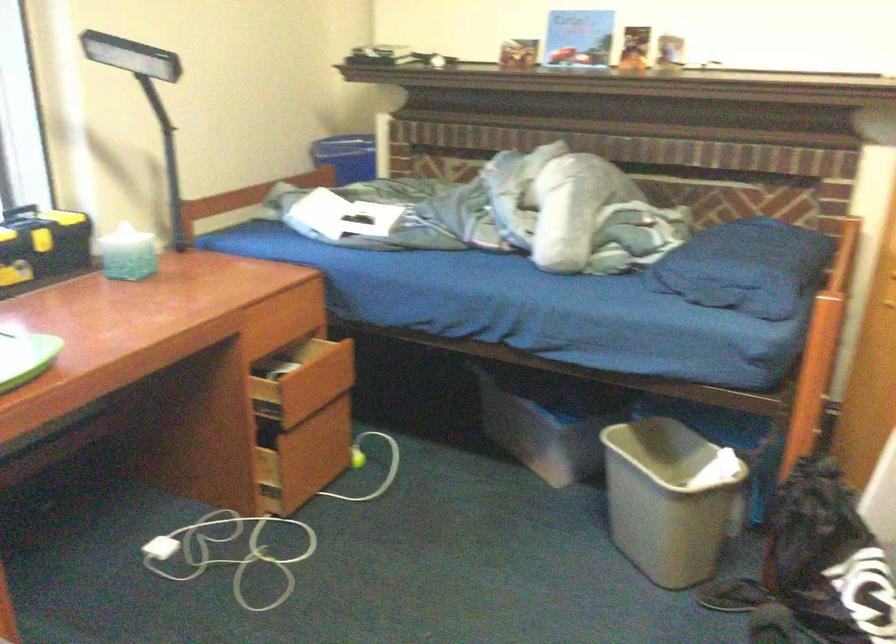
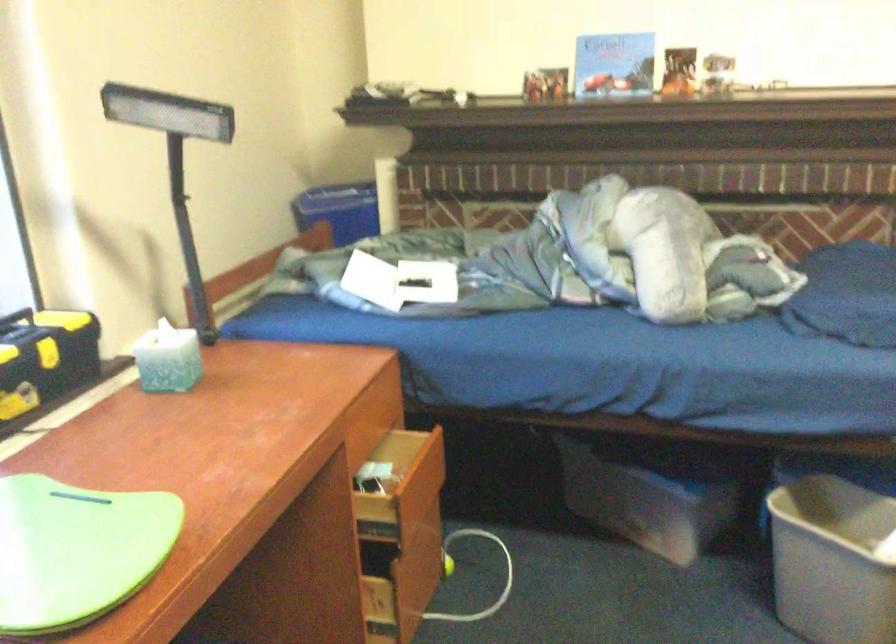
Find the pixel in the second image that matches [316,386] in the first image.

(419, 489)